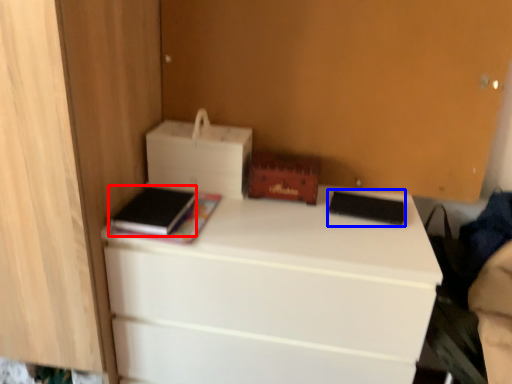
Question: Among these objects, which one is farthest to the camera, paperback book (highlighted by a red box) or paperback book (highlighted by a blue box)?

Choices:
 (A) paperback book
 (B) paperback book

Answer: (B)